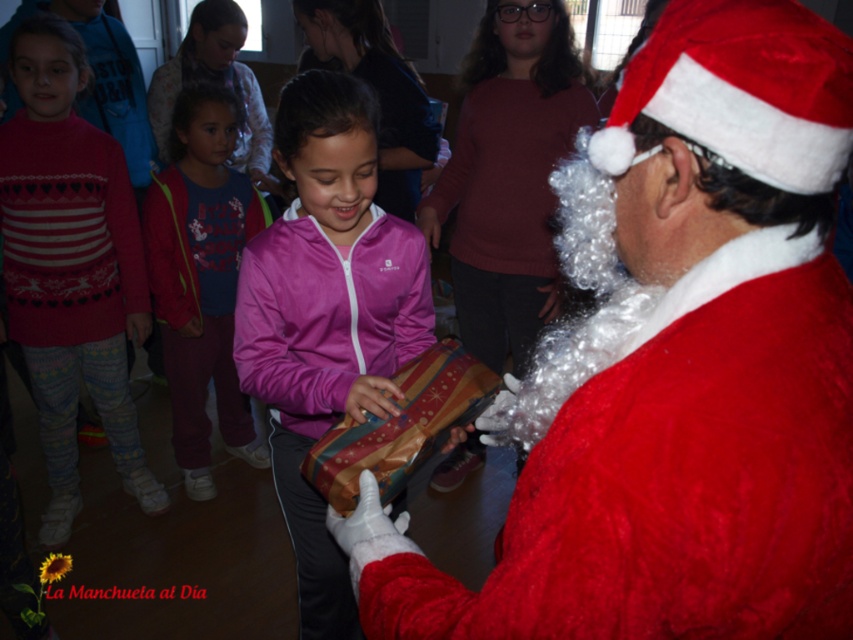
Question: Is velvet red santa claus at center closer to camera compared to matte pink jacket at center?

Choices:
 (A) no
 (B) yes

Answer: (B)

Question: Which is farther from the shiny metallic gift at center?

Choices:
 (A) knitted sweater at left
 (B) pink fabric jacket at center

Answer: (A)

Question: Does pink fabric jacket at center have a larger size compared to matte pink jacket at center?

Choices:
 (A) no
 (B) yes

Answer: (B)

Question: Which object is farther from the camera taking this photo?

Choices:
 (A) matte pink jacket at center
 (B) knitted sweater at left
 (C) velvet red santa claus at center
 (D) pink fabric jacket at center

Answer: (A)

Question: Does velvet red santa claus at center have a lesser width compared to shiny metallic gift at center?

Choices:
 (A) yes
 (B) no

Answer: (B)

Question: Which point appears closest to the camera in this image?

Choices:
 (A) (189, 240)
 (B) (292, 112)
 (C) (129, 202)

Answer: (B)